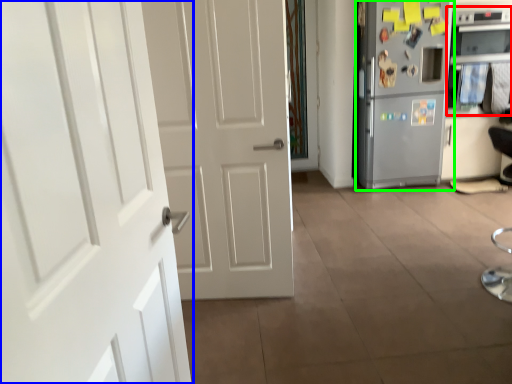
Question: Based on their relative distances, which object is nearer to oven (highlighted by a red box)? Choose from door (highlighted by a blue box) and refrigerator (highlighted by a green box).

Choices:
 (A) door
 (B) refrigerator

Answer: (B)